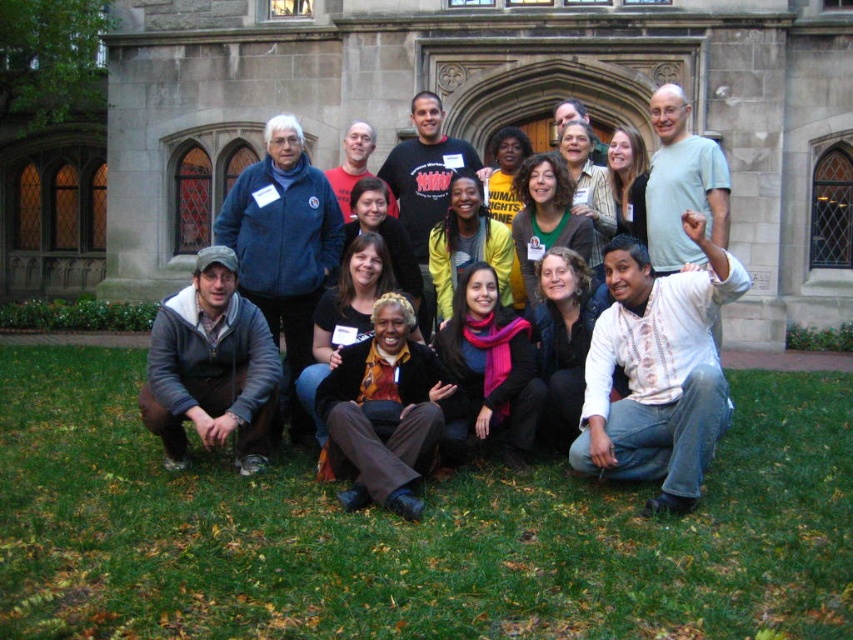
How far apart are gray woolen jacket at lower left and brown textured pants at center?

A distance of 4.66 meters exists between gray woolen jacket at lower left and brown textured pants at center.

Is point (264, 333) farther from viewer compared to point (345, 404)?

Yes, point (264, 333) is behind point (345, 404).

Is point (242, 472) positioned behind point (399, 356)?

No.

What are the coordinates of `gray woolen jacket at lower left` in the screenshot? It's located at (212, 368).

Can you confirm if green grass at lower center is smaller than gray woolen jacket at lower left?

Yes, green grass at lower center is smaller than gray woolen jacket at lower left.

The width and height of the screenshot is (853, 640). Identify the location of green grass at lower center. (410, 531).

Is yellow fabric shirt at center closer to the viewer compared to matte black t-shirt at center?

Yes, yellow fabric shirt at center is in front of matte black t-shirt at center.

Between point (486, 227) and point (387, 188), which one is positioned in front?

Point (486, 227) is in front.

This screenshot has height=640, width=853. What are the coordinates of `yellow fabric shirt at center` in the screenshot? It's located at (467, 243).